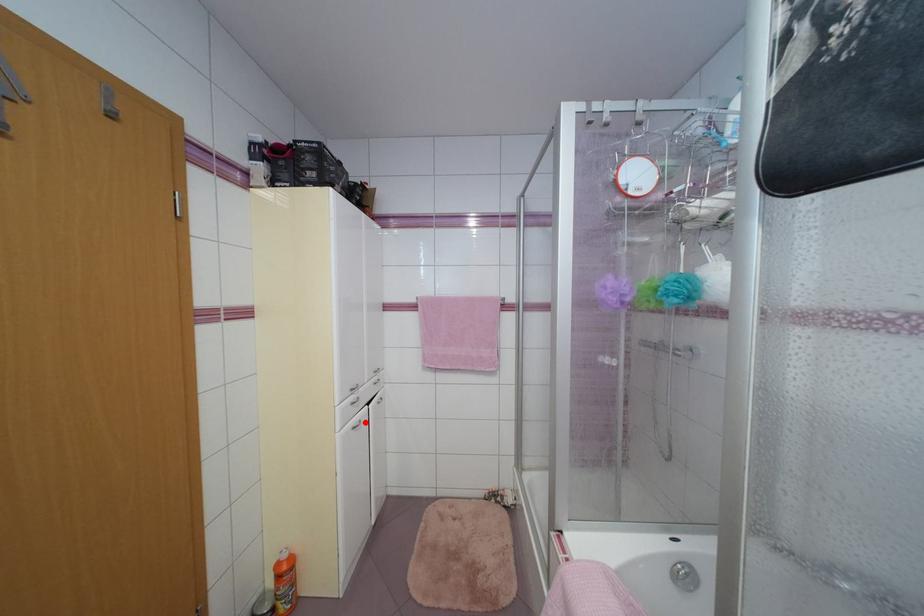
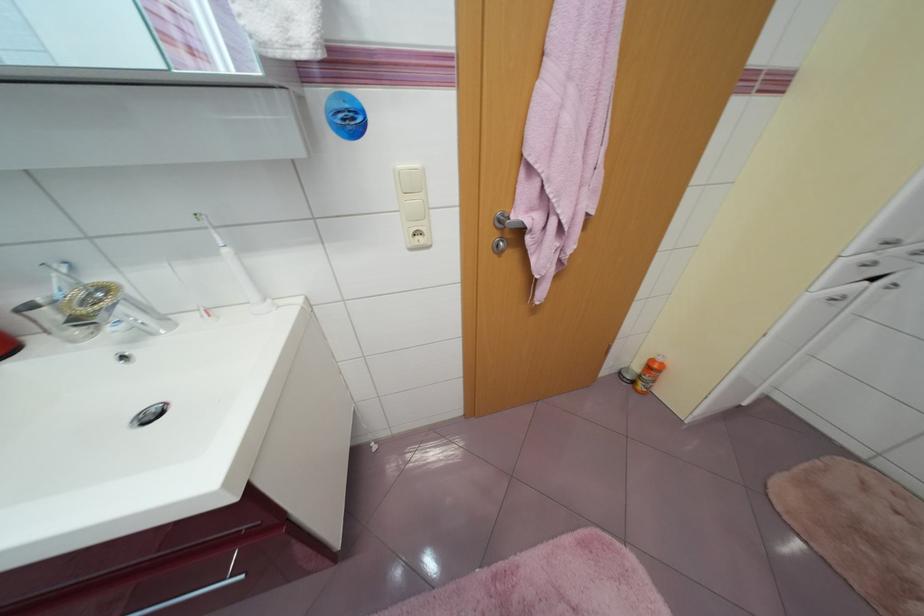
In the second image, find the point that corresponds to the highlighted location in the first image.

(849, 297)